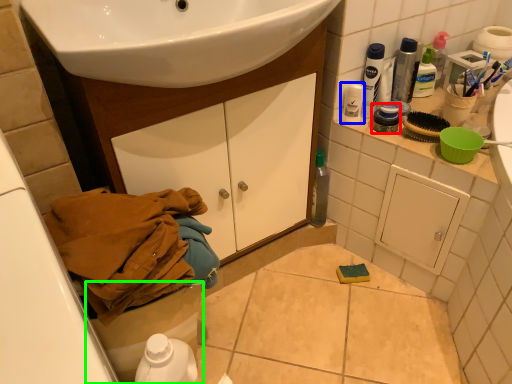
Question: Based on their relative distances, which object is nearer to mouthwash (highlighted by a red box)? Choose from toiletry (highlighted by a blue box) and toilet bowl (highlighted by a green box).

Choices:
 (A) toiletry
 (B) toilet bowl

Answer: (A)